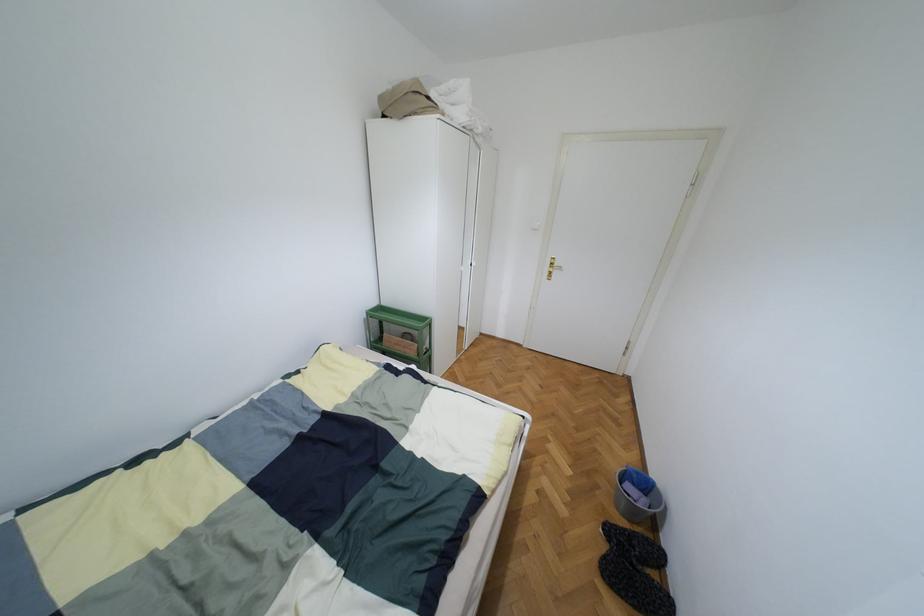
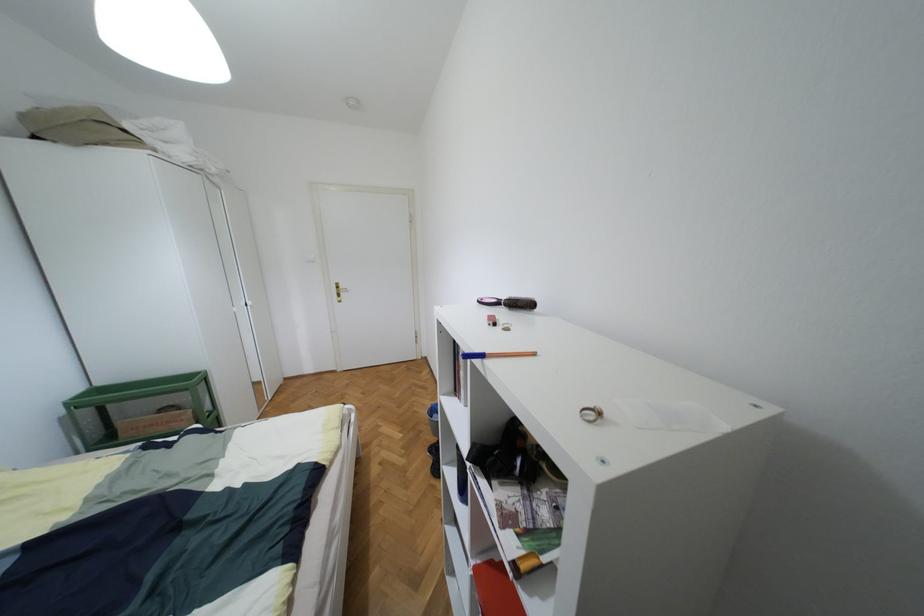
Question: How did the camera likely rotate?

Choices:
 (A) Left
 (B) Right
 (C) Up
 (D) Down

Answer: (B)